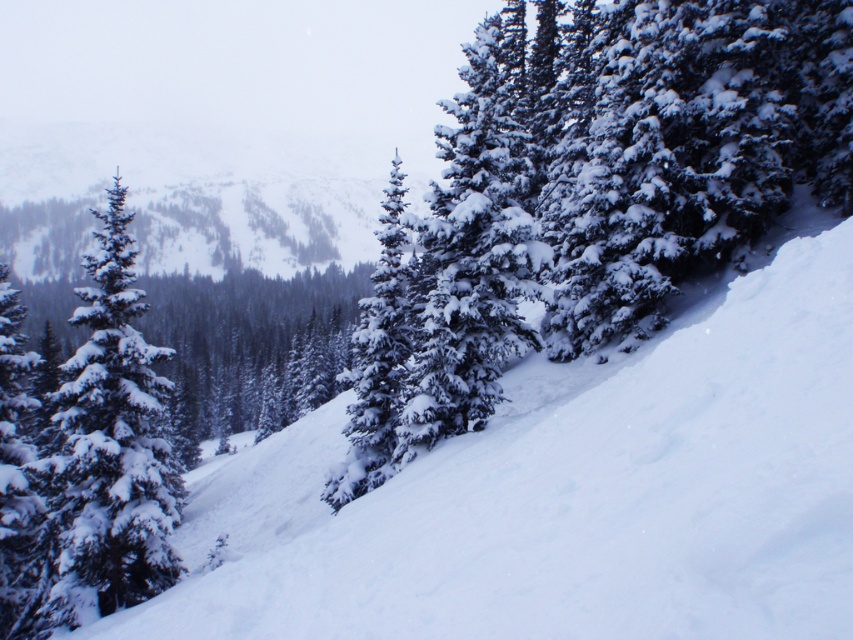
From the picture: You are standing at the bottom of the slope in the winter landscape. There is a point marked at coordinates (567, 493). What is located at that point?

The point at coordinates (567, 493) is occupied by white snow at center.